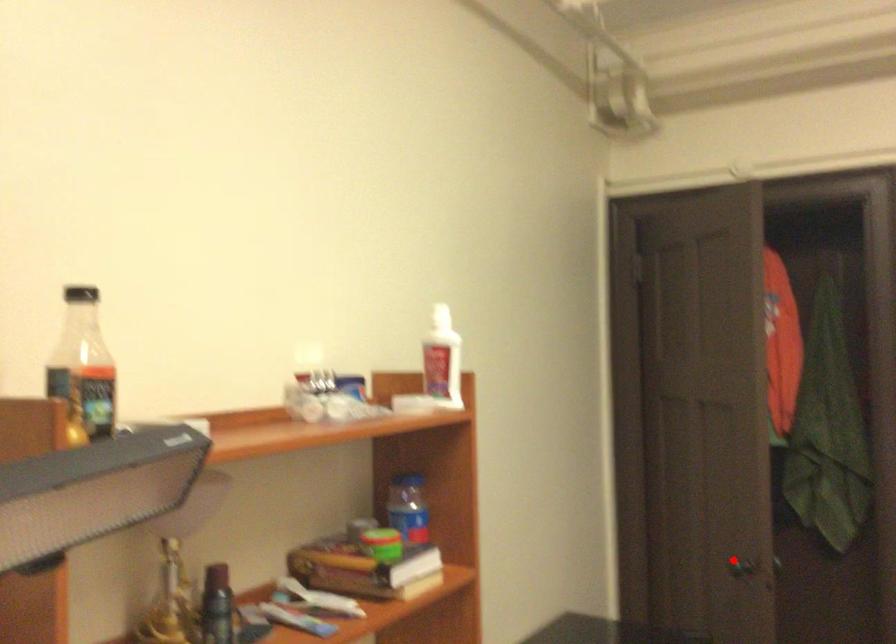
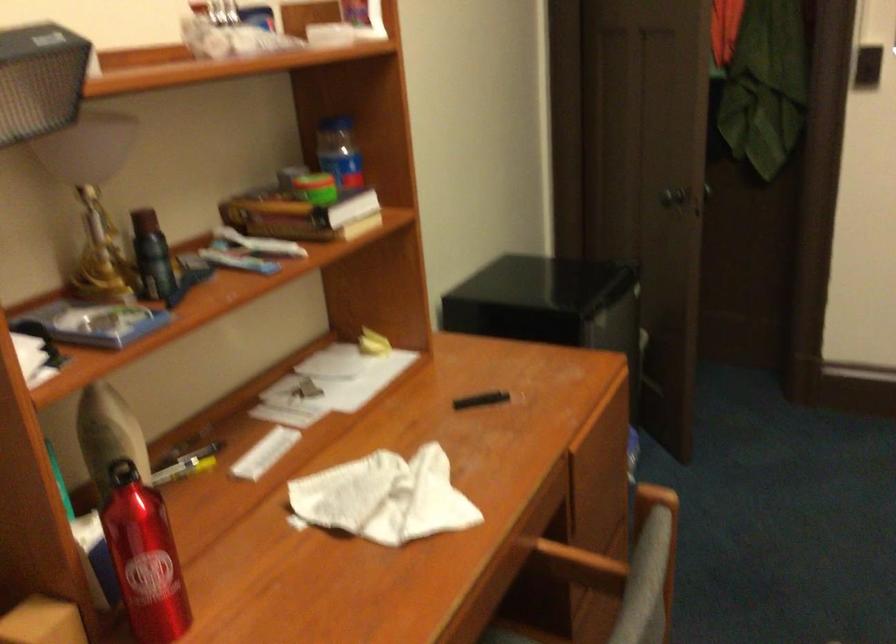
Locate, in the second image, the point that corresponds to the highlighted location in the first image.

(666, 194)